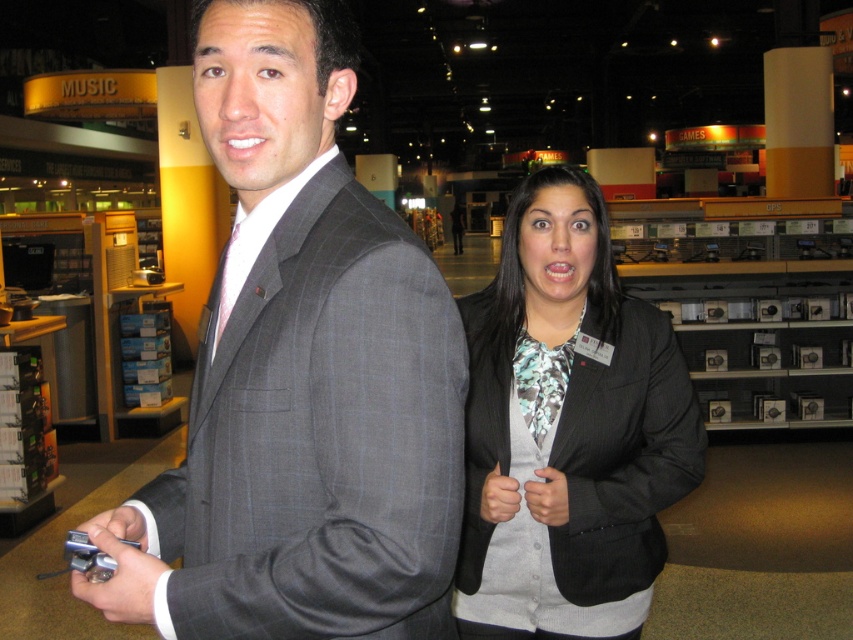
Question: Which point is closer to the camera?

Choices:
 (A) matte black blazer at center
 (B) gray pinstripe suit at center

Answer: (B)

Question: Is gray pinstripe suit at center to the left of matte black blazer at center from the viewer's perspective?

Choices:
 (A) yes
 (B) no

Answer: (A)

Question: Which point is farther to the camera?

Choices:
 (A) (462, 531)
 (B) (379, 451)

Answer: (A)

Question: Can you confirm if gray pinstripe suit at center is bigger than matte black blazer at center?

Choices:
 (A) yes
 (B) no

Answer: (B)

Question: Can you confirm if gray pinstripe suit at center is thinner than matte black blazer at center?

Choices:
 (A) yes
 (B) no

Answer: (A)